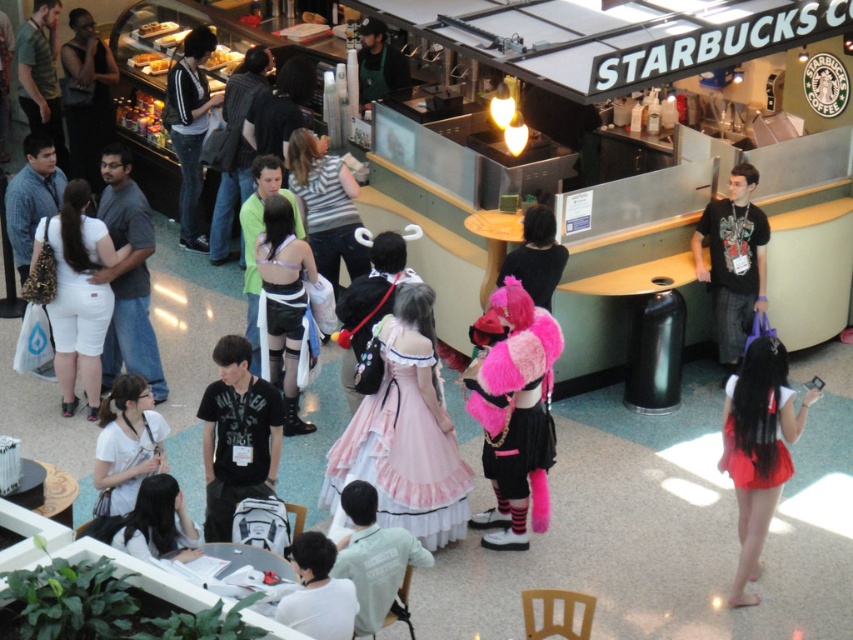
Question: Which point is farther to the camera?

Choices:
 (A) (258, 259)
 (B) (749, 506)
 (C) (766, 467)
 (D) (115, 545)

Answer: (A)

Question: Which object appears closest to the camera in this image?

Choices:
 (A) pink satin dress at center
 (B) white fabric shirt at lower left
 (C) red satin dress at lower right
 (D) matte black shirt at upper left

Answer: (B)

Question: Is fuzzy pink skirt at center positioned behind white fabric shirt at lower left?

Choices:
 (A) no
 (B) yes

Answer: (B)

Question: Based on their relative distances, which object is farther from the black fuzzy hat at center?

Choices:
 (A) dark gray hoodie at upper left
 (B) leather skirt at center

Answer: (A)

Question: Is red satin skirt at lower right smaller than white denim shorts at left?

Choices:
 (A) no
 (B) yes

Answer: (B)

Question: Does dark gray hoodie at upper left appear on the right side of red satin dress at lower right?

Choices:
 (A) yes
 (B) no

Answer: (B)